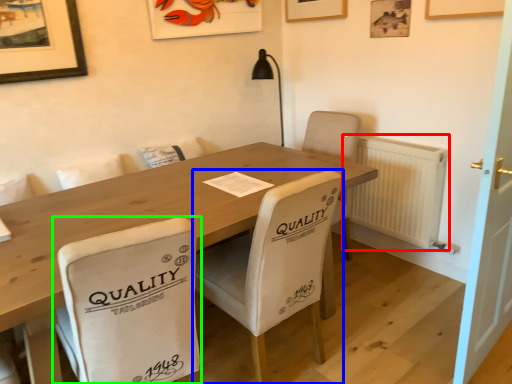
Question: Which object is the closest to the radiator (highlighted by a red box)? Choose among these: chair (highlighted by a blue box) or chair (highlighted by a green box).

Choices:
 (A) chair
 (B) chair

Answer: (A)